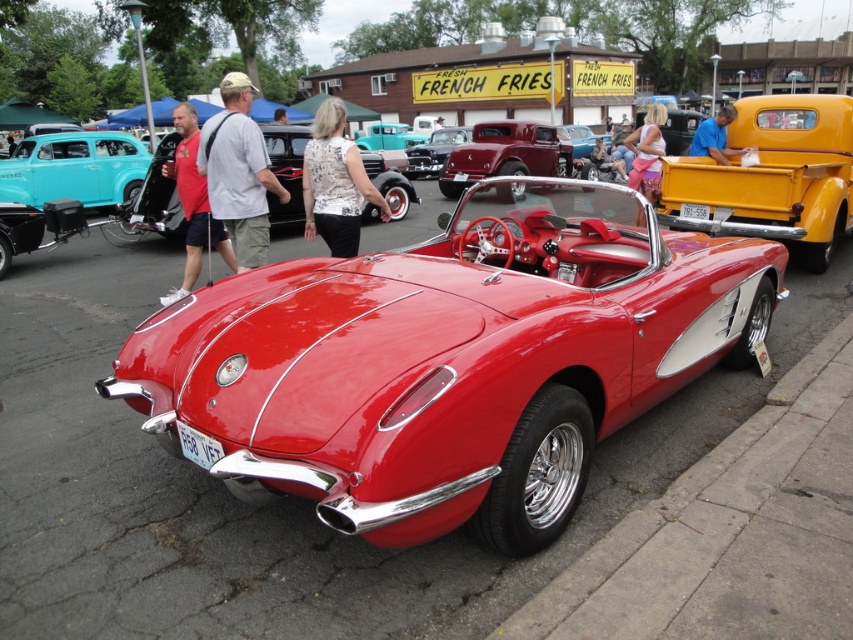
Question: Based on their relative distances, which object is farther from the white floral blouse at center?

Choices:
 (A) shiny maroon car at center
 (B) pink fabric pants at center
 (C) blue fabric shirt at upper center
 (D) teal matte sedan at left

Answer: (D)

Question: Which of the following is the farthest from the observer?

Choices:
 (A) (631, 136)
 (B) (343, 112)

Answer: (A)

Question: Is shiny red convertible at center above blue fabric shirt at upper center?

Choices:
 (A) yes
 (B) no

Answer: (B)

Question: Is teal matte sedan at left positioned before white floral blouse at center?

Choices:
 (A) yes
 (B) no

Answer: (B)

Question: Observing the image, what is the correct spatial positioning of teal matte sedan at left in reference to white floral blouse at center?

Choices:
 (A) above
 (B) below

Answer: (A)

Question: Which point is closer to the camera?

Choices:
 (A) (308, 211)
 (B) (547, 301)

Answer: (B)